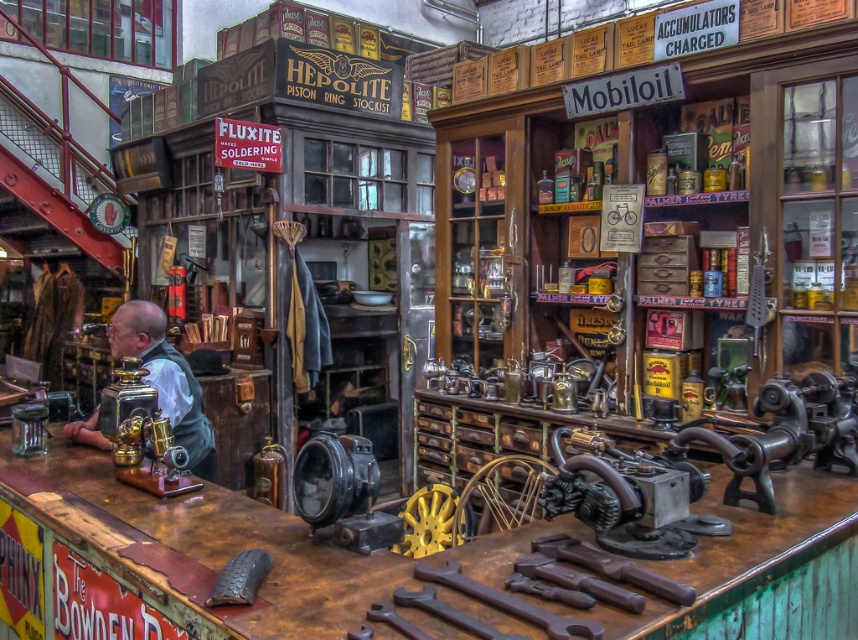
Is the position of brass/bronze steampunk device at left less distant than that of gold brass sewing machine at center?

That is False.

Is brass/bronze steampunk device at left below gold brass sewing machine at center?

Actually, brass/bronze steampunk device at left is above gold brass sewing machine at center.

Where is `brass/bronze steampunk device at left`? This screenshot has width=858, height=640. brass/bronze steampunk device at left is located at coordinates (166, 380).

Is dark brown metal wrenches at center to the left of brass/bronze steampunk device at left from the viewer's perspective?

Incorrect, dark brown metal wrenches at center is not on the left side of brass/bronze steampunk device at left.

Does dark brown metal wrenches at center have a lesser width compared to brass/bronze steampunk device at left?

No.

Locate an element on the screen. Image resolution: width=858 pixels, height=640 pixels. dark brown metal wrenches at center is located at coordinates (593, 576).

This screenshot has width=858, height=640. What are the coordinates of `dark brown metal wrenches at center` in the screenshot? It's located at (593, 576).

Does rusty metal workbench at center have a greater height compared to brass/bronze steampunk device at left?

No.

Between rusty metal workbench at center and brass/bronze steampunk device at left, which one is positioned higher?

brass/bronze steampunk device at left

Find the location of a particular element. The image size is (858, 640). rusty metal workbench at center is located at coordinates (209, 550).